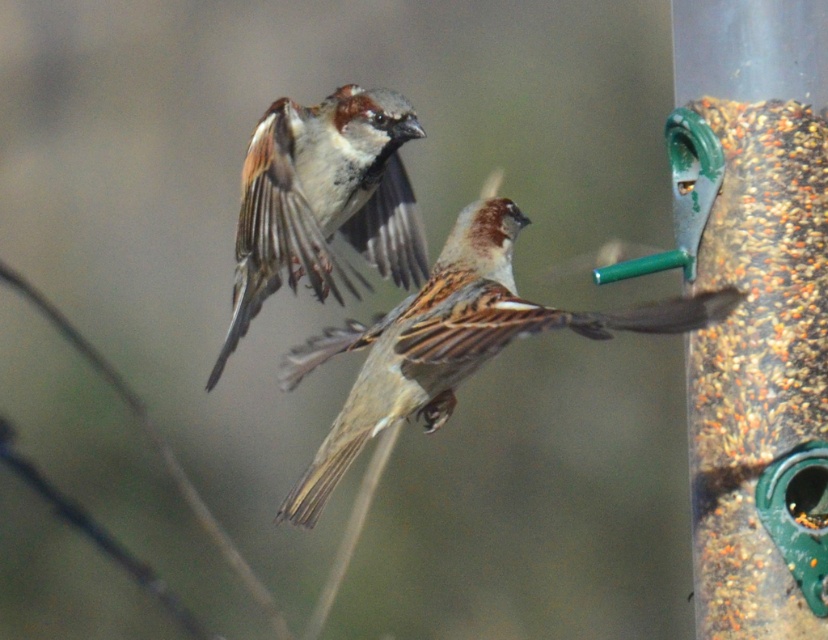
You are a photographer aiming to capture the brown feathered sparrow at center. The camera is focused at point (451, 342). Is the brown feathered sparrow at center in focus?

The point (451, 342) corresponds to the brown feathered sparrow at center, so yes, the brown feathered sparrow at center is in focus.

You are a birdwatcher trying to identify two sparrows in the image. Which sparrow, the brown feathered sparrow at center or the brown feathered sparrow at upper center, is located to the right of the other?

The brown feathered sparrow at center is positioned on the right side of brown feathered sparrow at upper center.